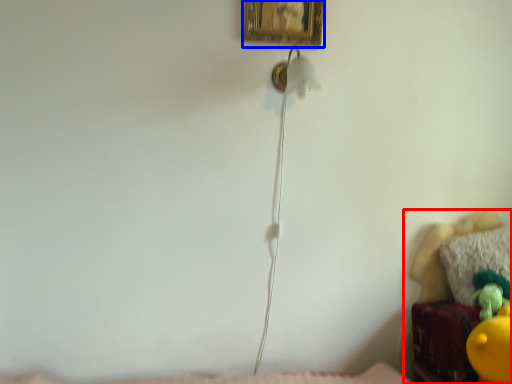
Question: Among these objects, which one is nearest to the camera, furniture (highlighted by a red box) or picture frame (highlighted by a blue box)?

Choices:
 (A) furniture
 (B) picture frame

Answer: (A)